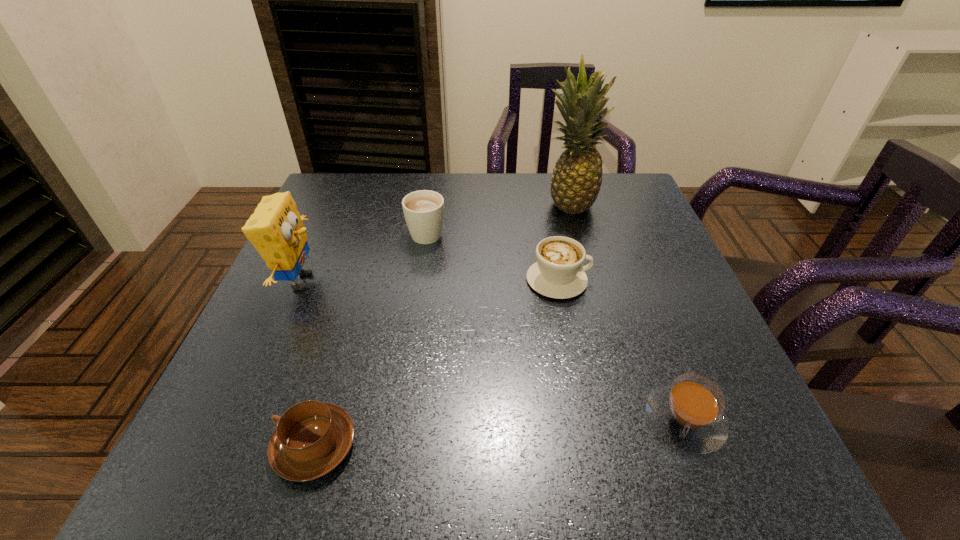
Where is `free space located on the face of the second tallest object`? This screenshot has width=960, height=540. free space located on the face of the second tallest object is located at coordinates (388, 281).

The image size is (960, 540). Find the location of `free space located 0.130m with the handle on the side of the fourth shortest object`. free space located 0.130m with the handle on the side of the fourth shortest object is located at coordinates (433, 191).

Identify the location of free space located with the handle on the side of the fourth shortest object. This screenshot has height=540, width=960. (431, 204).

Where is `vacant space situated 0.090m with the handle on the side of the fourth shortest object`? This screenshot has height=540, width=960. vacant space situated 0.090m with the handle on the side of the fourth shortest object is located at coordinates (432, 198).

Locate an element on the screen. The width and height of the screenshot is (960, 540). vacant space situated to the right of the third nearest cappuccino's handle is located at coordinates (645, 280).

Find the location of a particular element. vacant region located on the left of the rightmost cappuccino is located at coordinates (494, 420).

The width and height of the screenshot is (960, 540). What are the coordinates of `pineapple situated at the far edge` in the screenshot? It's located at (577, 177).

Find the location of `cappuccino that is at the far edge`. cappuccino that is at the far edge is located at coordinates (423, 210).

I want to click on sponge that is at the left edge, so tap(275, 229).

The image size is (960, 540). In order to click on cappuccino that is positioned at the left edge in this screenshot , I will do `click(312, 438)`.